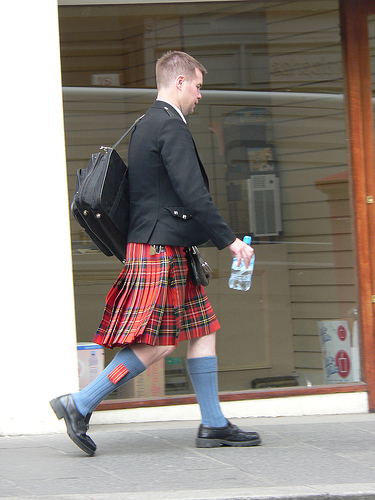
Image resolution: width=375 pixels, height=500 pixels. What are the coordinates of `bottle` in the screenshot? It's located at (240, 273), (247, 240).